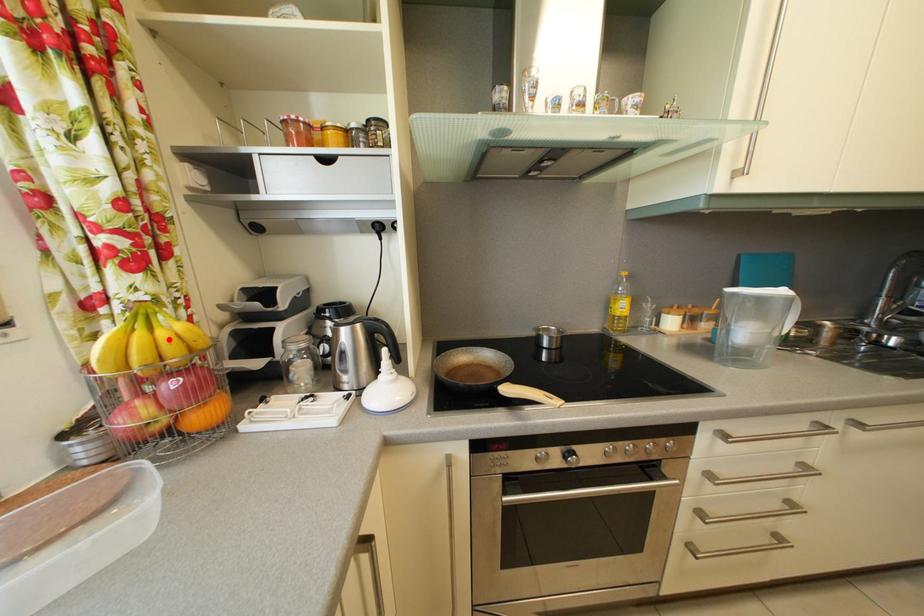
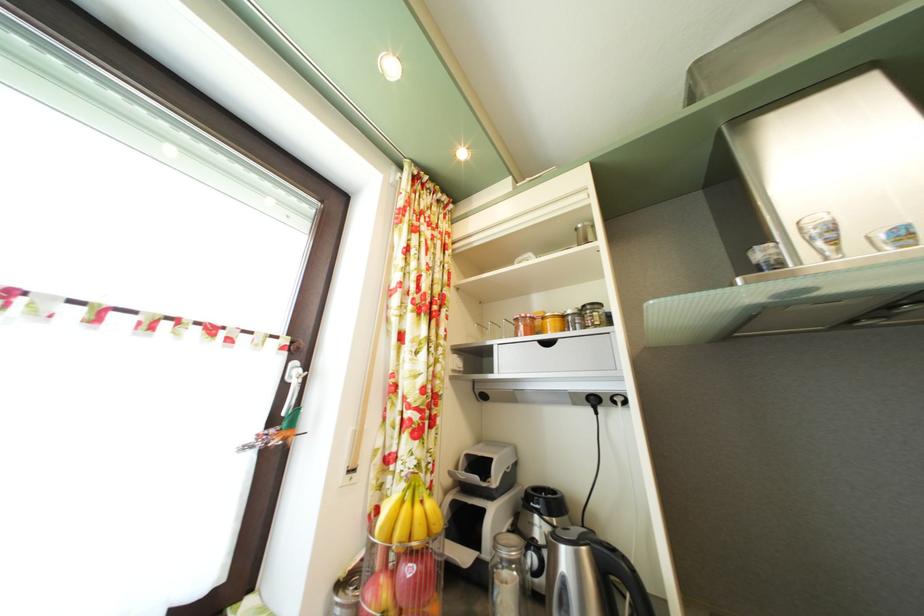
The point at the highlighted location is marked in the first image. Where is the corresponding point in the second image?

(426, 516)